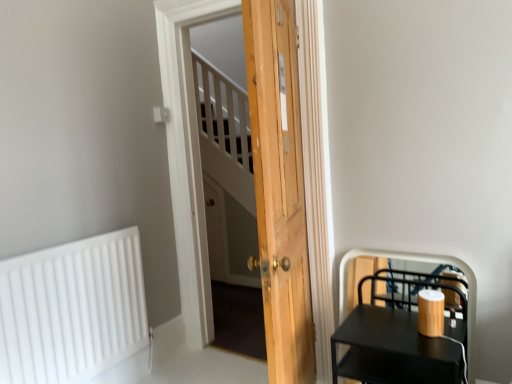
Question: Is natural wood door at center further to camera compared to white matte radiator at lower left?

Choices:
 (A) yes
 (B) no

Answer: (B)

Question: Is the surface of natural wood door at center in direct contact with white matte radiator at lower left?

Choices:
 (A) no
 (B) yes

Answer: (A)

Question: Is natural wood door at center located outside white matte radiator at lower left?

Choices:
 (A) yes
 (B) no

Answer: (A)

Question: From a real-world perspective, is natural wood door at center below white matte radiator at lower left?

Choices:
 (A) no
 (B) yes

Answer: (A)

Question: Does natural wood door at center have a lesser height compared to white matte radiator at lower left?

Choices:
 (A) no
 (B) yes

Answer: (A)

Question: Is natural wood door at center facing towards white matte radiator at lower left?

Choices:
 (A) yes
 (B) no

Answer: (B)

Question: Are white matte radiator at lower left and black matte side table at lower right making contact?

Choices:
 (A) no
 (B) yes

Answer: (A)

Question: Could you tell me if white matte radiator at lower left is turned towards black matte side table at lower right?

Choices:
 (A) yes
 (B) no

Answer: (A)

Question: Is white matte radiator at lower left outside of black matte side table at lower right?

Choices:
 (A) no
 (B) yes

Answer: (B)

Question: Could black matte side table at lower right be considered to be inside white matte radiator at lower left?

Choices:
 (A) no
 (B) yes

Answer: (A)

Question: Is white matte radiator at lower left behind black matte side table at lower right?

Choices:
 (A) yes
 (B) no

Answer: (A)

Question: From a real-world perspective, is white matte radiator at lower left positioned under black matte side table at lower right based on gravity?

Choices:
 (A) no
 (B) yes

Answer: (A)

Question: Is black matte side table at lower right wider than white matte radiator at lower left?

Choices:
 (A) yes
 (B) no

Answer: (A)